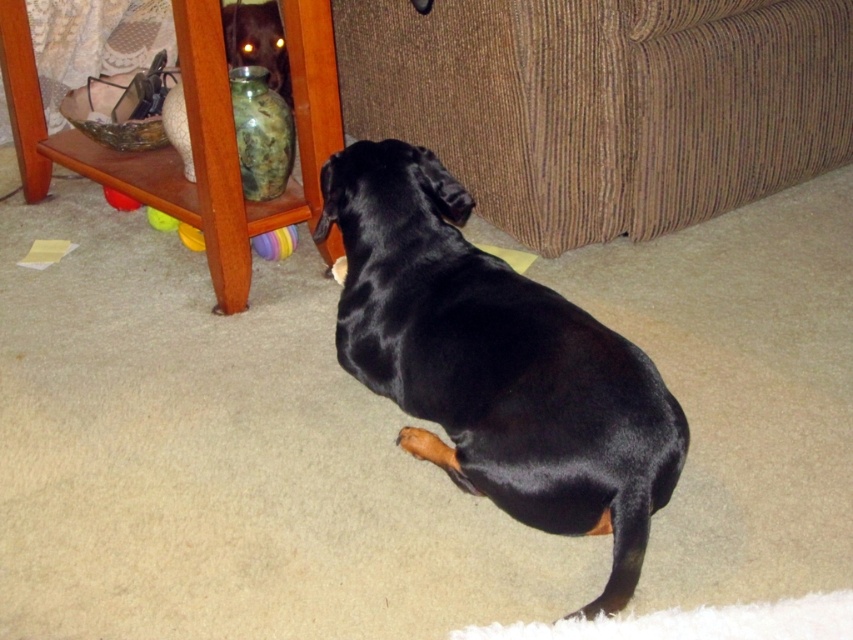
You are a dog who wants to play with the rubber ball at lower left and the yellow rubber toy at lower left. Which toy is closer to you if you are lying on the carpet where the black dachshund is?

The rubber ball at lower left is closer because it is in front of the yellow rubber toy at lower left from your perspective.

You are a dog owner who wants to throw a yellow rubber ball at lower left to the brown corduroy couch at upper right. Can you estimate if the ball will land on the couch?

The brown corduroy couch at upper right is to the right of the yellow rubber ball at lower left, but the couch is located in the background and elevated, so the ball might not reach it unless thrown with enough force.

You are standing at the origin of the coordinate system in the image. You want to walk to the point at the location of point (107,189). Which direction should you move first relative to the point (161,225)?

Point (107,189) is behind point (161,225), so you should move backward from point (161,225) to reach point (107,189).